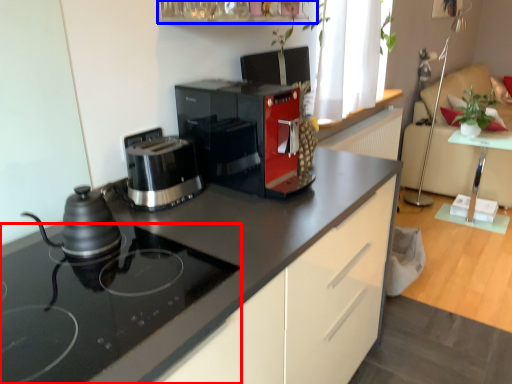
Question: Which object appears closest to the camera in this image, home appliance (highlighted by a red box) or shelf (highlighted by a blue box)?

Choices:
 (A) home appliance
 (B) shelf

Answer: (A)